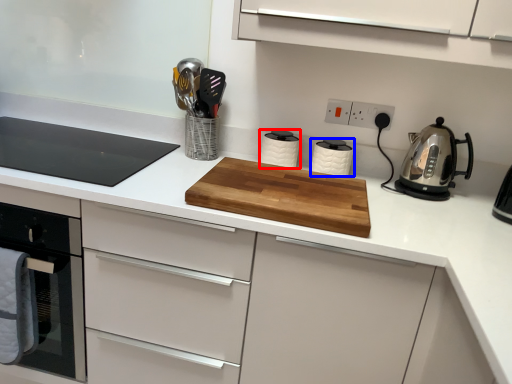
Question: Which object is closer to the camera taking this photo, kitchen appliance (highlighted by a red box) or kitchen appliance (highlighted by a blue box)?

Choices:
 (A) kitchen appliance
 (B) kitchen appliance

Answer: (B)